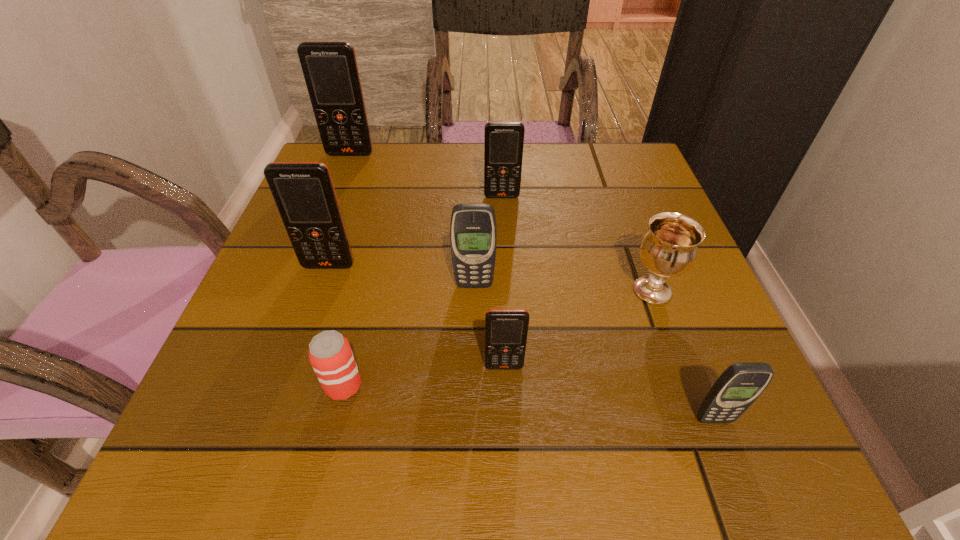
I want to click on the smallest orange cellular telephone, so click(506, 330).

The image size is (960, 540). Identify the location of the rightmost cellular telephone. (737, 388).

Where is `the right gray cellular telephone`? Image resolution: width=960 pixels, height=540 pixels. the right gray cellular telephone is located at coordinates [x=737, y=388].

The width and height of the screenshot is (960, 540). What are the coordinates of `beer can` in the screenshot? It's located at (330, 354).

Where is `orange beer can`? orange beer can is located at coordinates (330, 354).

Find the location of a particular element. The height and width of the screenshot is (540, 960). vacant space positioned on the screen of the farthest orange cellular telephone is located at coordinates (310, 257).

At what (x,y) coordinates should I click in order to perform the action: click on free space located on the screen of the third farthest object. Please return your answer as a coordinate pair (x, y). The image size is (960, 540). Looking at the image, I should click on (279, 412).

This screenshot has width=960, height=540. Find the location of `blank area located on the screen of the third nearest cellular telephone`. blank area located on the screen of the third nearest cellular telephone is located at coordinates (474, 314).

The width and height of the screenshot is (960, 540). I want to click on vacant point located on the screen of the second farthest orange cellular telephone, so click(x=509, y=312).

In order to click on vacant region located on the left of the chalice in this screenshot , I will do `click(579, 291)`.